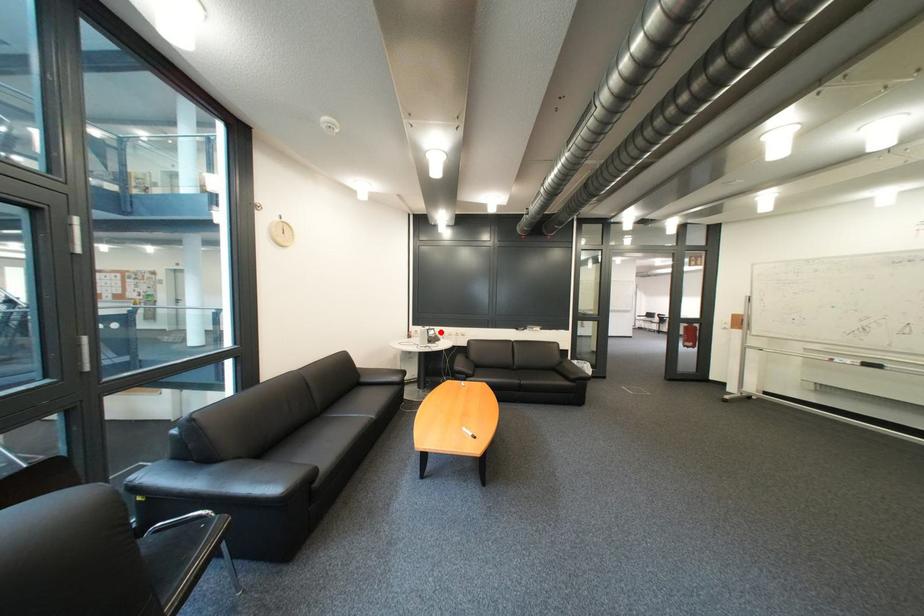
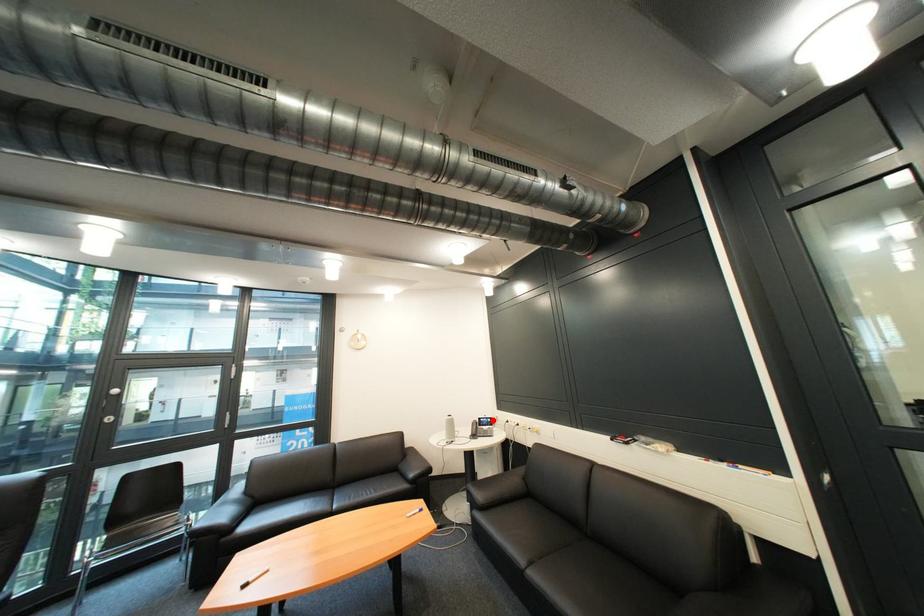
Consider the image. I am providing you with two images of the same scene from different viewpoints. A red point is marked on the first image and another point is marked on the second image. Is the marked point in image1 the same physical position as the marked point in image2?

Yes